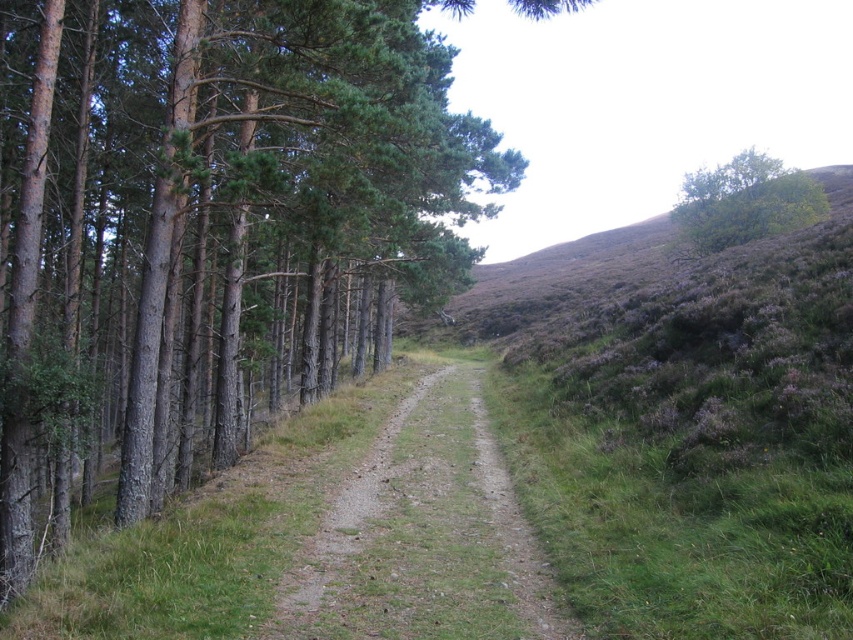
Is dirt/gravel path at center to the right of green leafy tree at upper right from the viewer's perspective?

In fact, dirt/gravel path at center is to the left of green leafy tree at upper right.

Who is more distant from viewer, (419, 472) or (714, 236)?

Positioned behind is point (714, 236).

Where is `dirt/gravel path at center`? This screenshot has width=853, height=640. dirt/gravel path at center is located at coordinates (425, 536).

Between brown textured tree at left and dirt/gravel path at center, which one is positioned higher?

brown textured tree at left is higher up.

Can you confirm if brown textured tree at left is wider than dirt/gravel path at center?

Yes.

Which is behind, point (129, 330) or point (413, 417)?

Point (129, 330)

Find the location of a particular element. This screenshot has width=853, height=640. brown textured tree at left is located at coordinates (206, 212).

Can you confirm if brown textured tree at left is positioned above green leafy tree at upper right?

Actually, brown textured tree at left is below green leafy tree at upper right.

Measure the distance between point (32, 476) and camera.

Point (32, 476) is 14.06 meters away from camera.

You are a GUI agent. You are given a task and a screenshot of the screen. Output one action in this format:
    pyautogui.click(x=<x>, y=<y>)
    Task: Click on the brown textured tree at left
    The height and width of the screenshot is (640, 853).
    Given the screenshot: What is the action you would take?
    pyautogui.click(x=206, y=212)